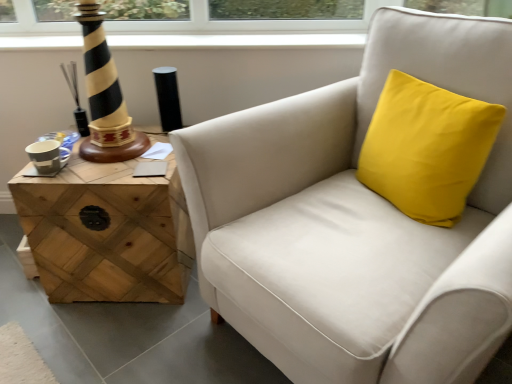
Question: Is yellow fabric cushion at upper right positioned before matte white armchair at center?

Choices:
 (A) no
 (B) yes

Answer: (A)

Question: From a real-world perspective, is yellow fabric cushion at upper right positioned over matte white armchair at center based on gravity?

Choices:
 (A) yes
 (B) no

Answer: (A)

Question: From the image's perspective, is yellow fabric cushion at upper right below matte white armchair at center?

Choices:
 (A) yes
 (B) no

Answer: (B)

Question: Is the depth of yellow fabric cushion at upper right greater than that of matte white armchair at center?

Choices:
 (A) yes
 (B) no

Answer: (A)

Question: Considering the relative sizes of yellow fabric cushion at upper right and matte white armchair at center in the image provided, is yellow fabric cushion at upper right shorter than matte white armchair at center?

Choices:
 (A) no
 (B) yes

Answer: (B)

Question: In terms of width, does yellow fabric cushion at upper right look wider or thinner when compared to matte white armchair at center?

Choices:
 (A) wide
 (B) thin

Answer: (B)

Question: Which is correct: yellow fabric cushion at upper right is inside matte white armchair at center, or outside of it?

Choices:
 (A) outside
 (B) inside

Answer: (B)

Question: From the image's perspective, is yellow fabric cushion at upper right located above or below matte white armchair at center?

Choices:
 (A) below
 (B) above

Answer: (B)

Question: From a real-world perspective, is yellow fabric cushion at upper right above or below matte white armchair at center?

Choices:
 (A) below
 (B) above

Answer: (B)

Question: From the image's perspective, is woodenmaterial/texturetable at left positioned above or below matte white armchair at center?

Choices:
 (A) below
 (B) above

Answer: (A)

Question: In terms of width, does woodenmaterial/texturetable at left look wider or thinner when compared to matte white armchair at center?

Choices:
 (A) wide
 (B) thin

Answer: (B)

Question: Is woodenmaterial/texturetable at left to the left or to the right of matte white armchair at center in the image?

Choices:
 (A) right
 (B) left

Answer: (B)

Question: Is woodenmaterial/texturetable at left inside the boundaries of matte white armchair at center, or outside?

Choices:
 (A) inside
 (B) outside

Answer: (B)

Question: From a real-world perspective, is woodenmaterial/texturetable at left above or below yellow fabric cushion at upper right?

Choices:
 (A) below
 (B) above

Answer: (A)

Question: Is woodenmaterial/texturetable at left inside or outside of yellow fabric cushion at upper right?

Choices:
 (A) inside
 (B) outside

Answer: (B)